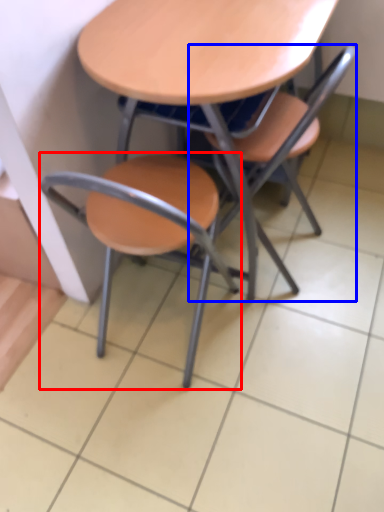
Question: Which object is closer to the camera taking this photo, chair (highlighted by a red box) or chair (highlighted by a blue box)?

Choices:
 (A) chair
 (B) chair

Answer: (A)